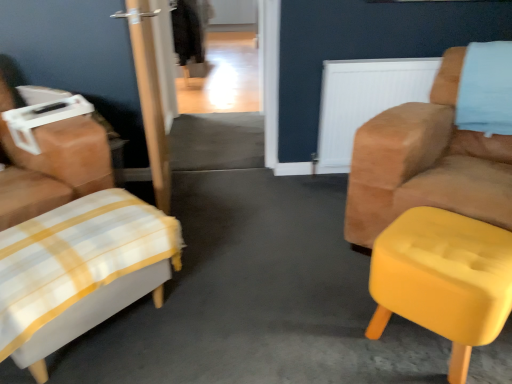
The image size is (512, 384). Find the location of `free point above white textured radiator at upper right (from a real-world perspective)`. free point above white textured radiator at upper right (from a real-world perspective) is located at coordinates (389, 64).